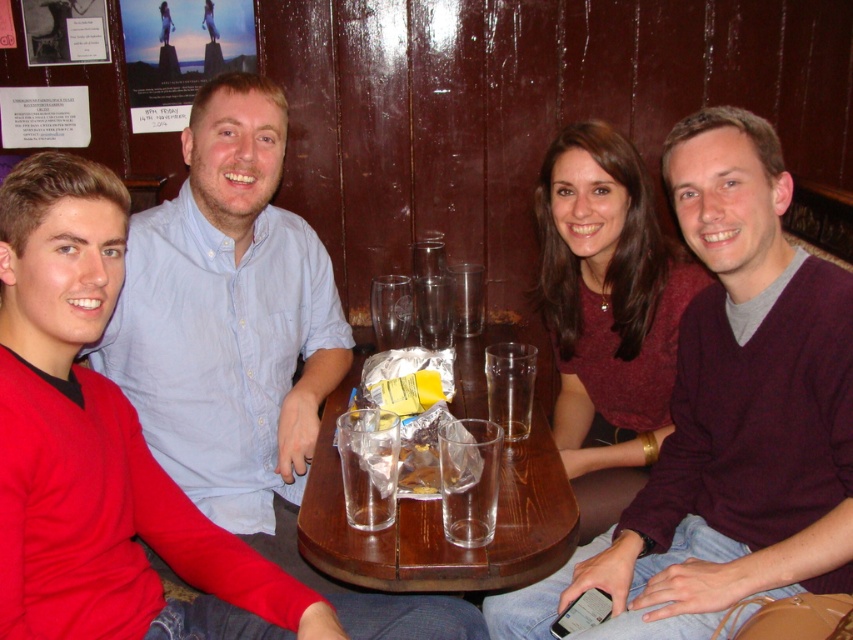
Which is below, blue button-down shirt at left or transparent glass table at center?

transparent glass table at center is lower down.

Is point (206, 364) positioned behind point (498, 572)?

Yes, point (206, 364) is behind point (498, 572).

I want to click on blue button-down shirt at left, so click(x=230, y=324).

Locate an element on the screen. The height and width of the screenshot is (640, 853). blue button-down shirt at left is located at coordinates click(x=230, y=324).

Who is higher up, maroon sweater at center or blue button-down shirt at left?

blue button-down shirt at left

In order to click on maroon sweater at center in this screenshot , I will do `click(729, 417)`.

Does maroon sweater at center appear on the left side of transparent glass table at center?

In fact, maroon sweater at center is to the right of transparent glass table at center.

This screenshot has width=853, height=640. What do you see at coordinates (729, 417) in the screenshot?
I see `maroon sweater at center` at bounding box center [729, 417].

Locate an element on the screen. maroon sweater at center is located at coordinates (729, 417).